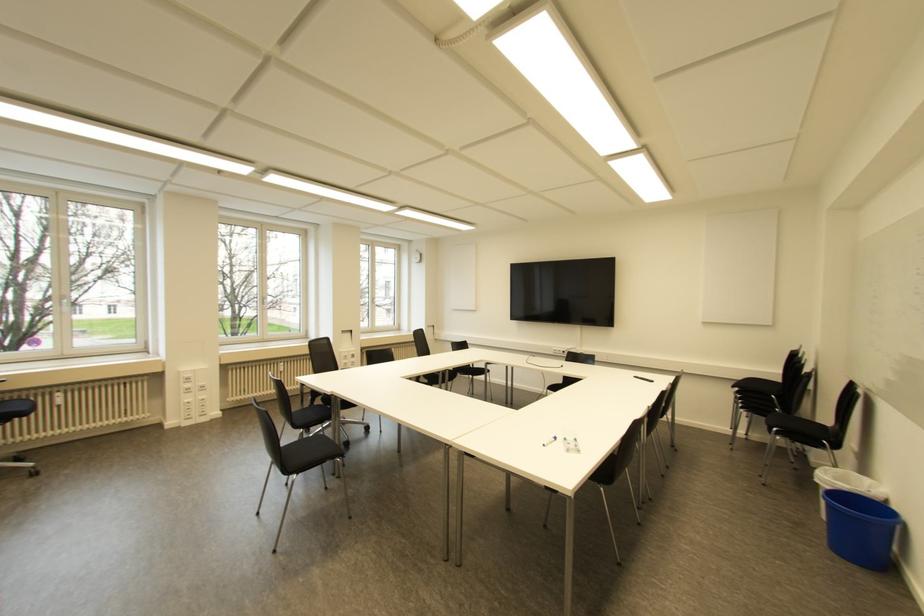
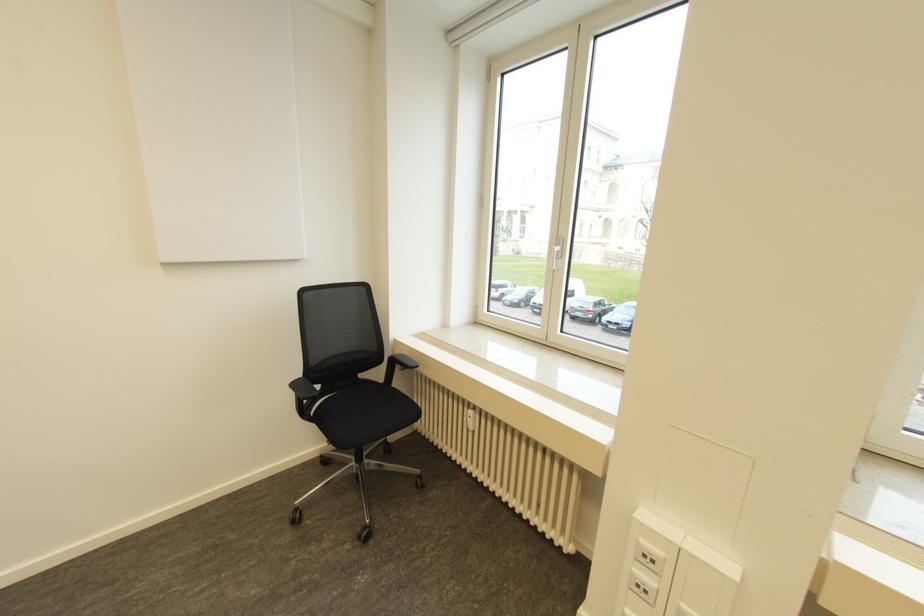
Locate, in the second image, the point that corresponds to the point at 56,394 in the first image.

(469, 411)